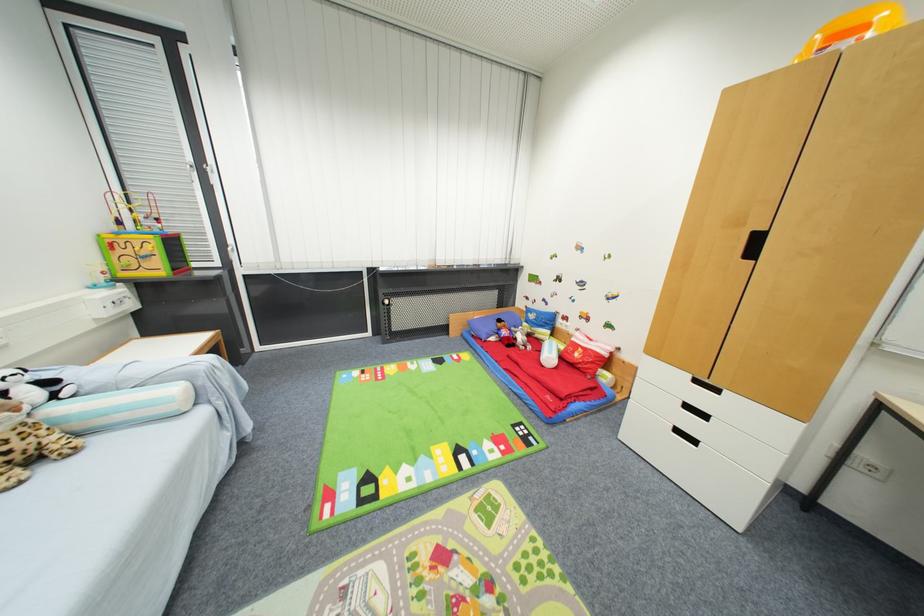
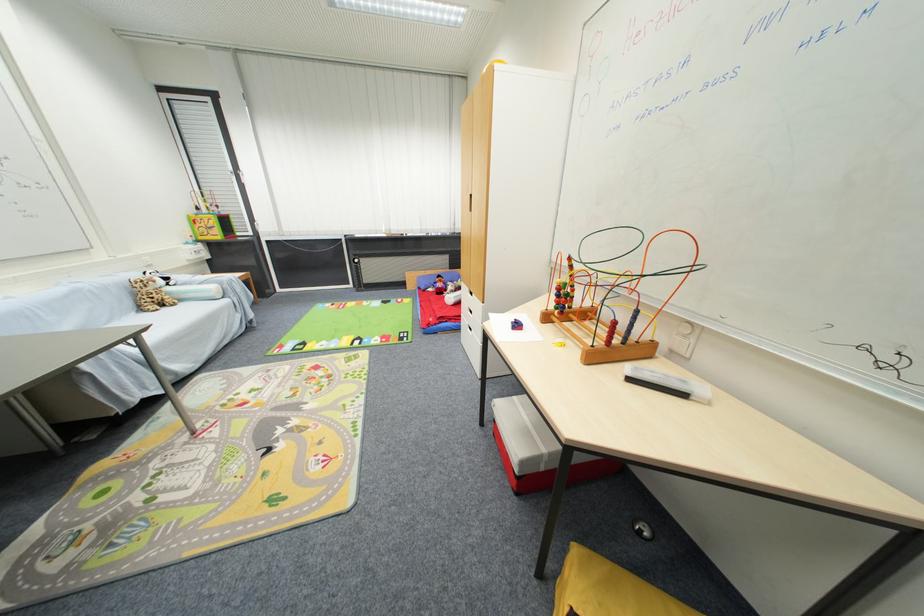
In the second image, find the point that corresponds to the point at 163,272 in the first image.

(223, 238)